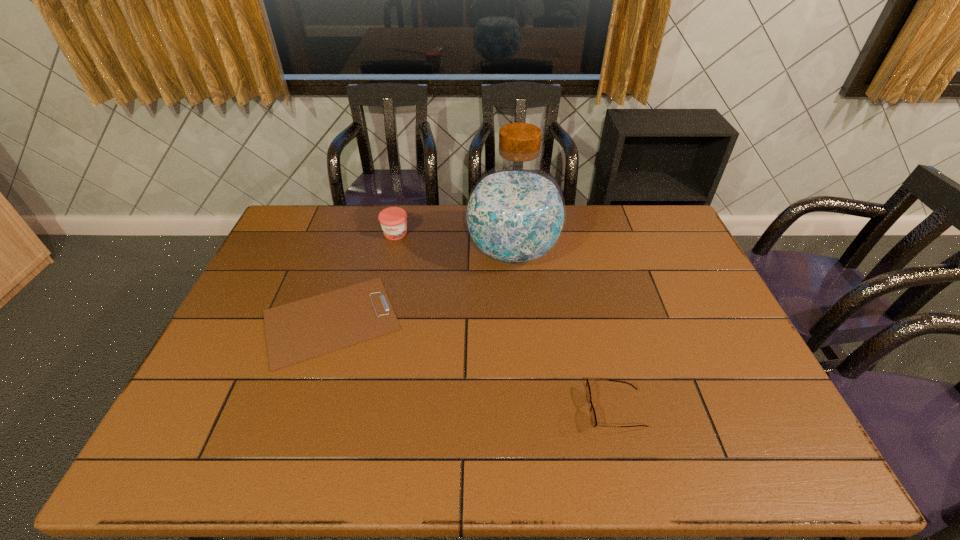
Where is `vacant space located 0.050m on the front of the shortest object`? The width and height of the screenshot is (960, 540). vacant space located 0.050m on the front of the shortest object is located at coordinates (309, 388).

Locate an element on the screen. The height and width of the screenshot is (540, 960). water jug situated at the far edge is located at coordinates (515, 214).

You are a GUI agent. You are given a task and a screenshot of the screen. Output one action in this format:
    pyautogui.click(x=<x>, y=<y>)
    Task: Click on the jam located in the far edge section of the desktop
    This screenshot has width=960, height=540.
    Given the screenshot: What is the action you would take?
    pos(393,220)

Identify the location of object located in the near edge section of the desktop. The image size is (960, 540). (588, 392).

Locate an element on the screen. This screenshot has height=540, width=960. object positioned at the left edge is located at coordinates (305, 329).

This screenshot has width=960, height=540. In the image, there is a desktop. What are the coordinates of `free space at the far edge` in the screenshot? It's located at (585, 220).

Where is `vacant space at the near edge of the desktop`? vacant space at the near edge of the desktop is located at coordinates (389, 463).

In the image, there is a desktop. Identify the location of free space at the left edge. The height and width of the screenshot is (540, 960). (261, 287).

In the image, there is a desktop. Identify the location of vacant region at the right edge. Image resolution: width=960 pixels, height=540 pixels. (654, 260).

Find the location of a particular element. The image size is (960, 540). free space at the far right corner of the desktop is located at coordinates tap(642, 236).